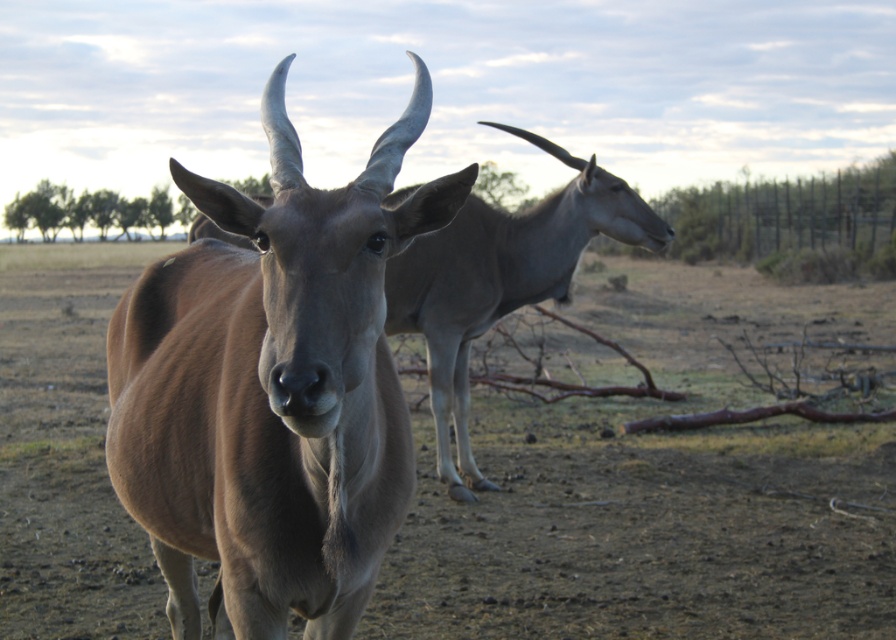
You are a wildlife photographer trying to capture a photo of both the brown smooth antelope at center and the brown matte antelope at center. Based on their positions, which antelope is closer to the camera?

The brown smooth antelope at center is closer to the camera because it is positioned below the brown matte antelope at center, indicating it is in front.

From the picture: You are a photographer trying to capture both antelopes in a single frame. The camera is positioned to focus on the antelope at the point marked by point (273, 388). Based on the scene, which direction should you move the camera to include the other antelope in the frame?

The other antelope is located to the right and further back from the brown smooth antelope at center marked by point (273, 388). To include it in the frame, move the camera slightly to the right and adjust the focus to capture the antelope further back.

You are a wildlife photographer trying to capture both the brown smooth antelope at center and the brown matte antelope at center in a single frame. Based on their sizes, which antelope will appear smaller in the photo?

The brown smooth antelope at center will appear smaller in the photo because it has a lesser width compared to the brown matte antelope at center.